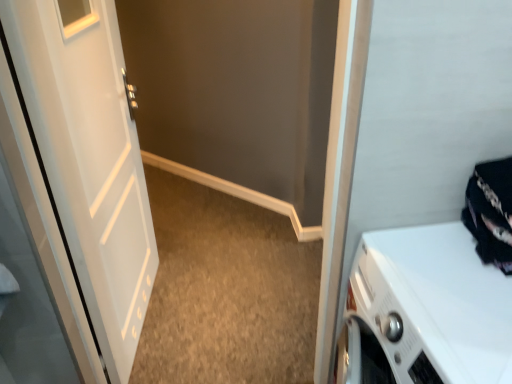
Question: Is point (473, 195) closer or farther from the camera than point (94, 130)?

Choices:
 (A) farther
 (B) closer

Answer: (B)

Question: Considering the positions of black fabric at right and white matte door at left in the image, is black fabric at right taller or shorter than white matte door at left?

Choices:
 (A) short
 (B) tall

Answer: (A)

Question: Which object is the farthest from the white glossy washing machine at lower right?

Choices:
 (A) white matte door at left
 (B) black fabric at right

Answer: (A)

Question: Which of these objects is positioned farthest from the white matte door at left?

Choices:
 (A) black fabric at right
 (B) white glossy washing machine at lower right

Answer: (A)